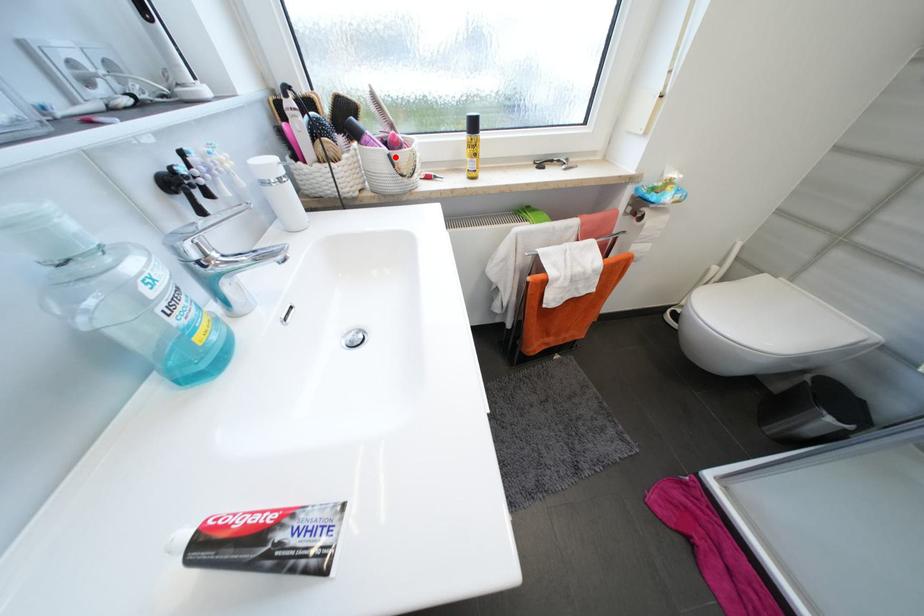
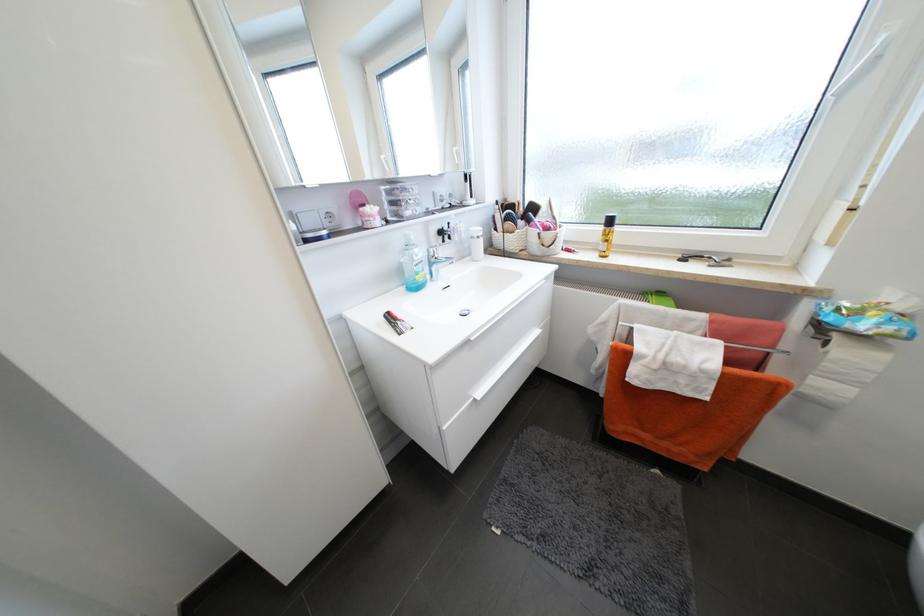
Question: I am providing you with two images of the same scene from different viewpoints. A red point is marked on the first image. Can you still see the location of the red point in image 2?

Choices:
 (A) Yes
 (B) No

Answer: (A)